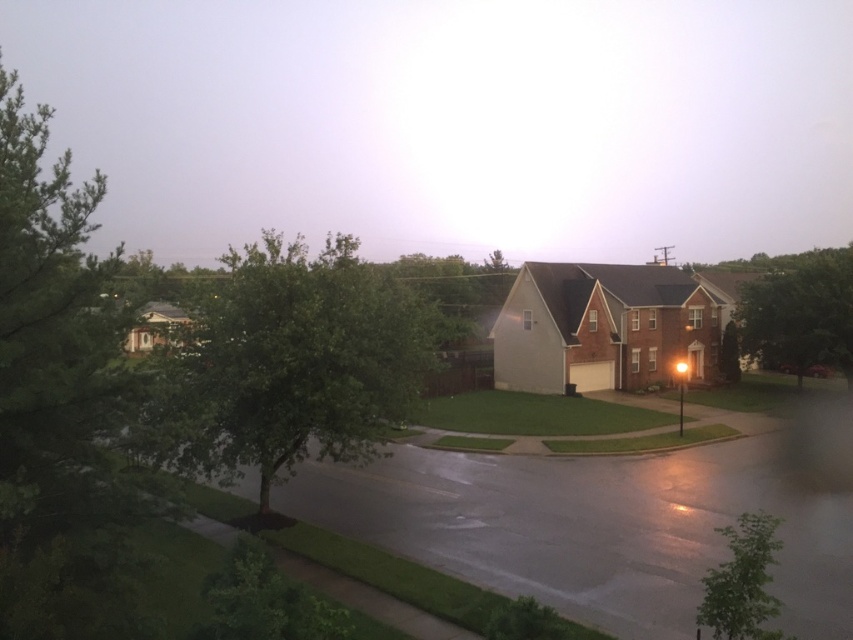
Between green leafy tree at center and green leafy tree at upper right, which one appears on the right side from the viewer's perspective?

green leafy tree at upper right

Consider the image. Is green leafy tree at center bigger than green leafy tree at upper right?

Correct, green leafy tree at center is larger in size than green leafy tree at upper right.

Where is `green leafy tree at center`? green leafy tree at center is located at coordinates (288, 364).

Does green leafy tree at center have a lesser height compared to green leafy tree at lower right?

No.

Between green leafy tree at center and green leafy tree at lower right, which one appears on the left side from the viewer's perspective?

green leafy tree at center

Does point (230, 467) come farther from viewer compared to point (720, 632)?

That is True.

The width and height of the screenshot is (853, 640). What are the coordinates of `green leafy tree at center` in the screenshot? It's located at (288, 364).

Is point (827, 321) farther from camera compared to point (706, 624)?

Yes, it is.

Where is `green leafy tree at upper right`? The width and height of the screenshot is (853, 640). green leafy tree at upper right is located at coordinates (799, 314).